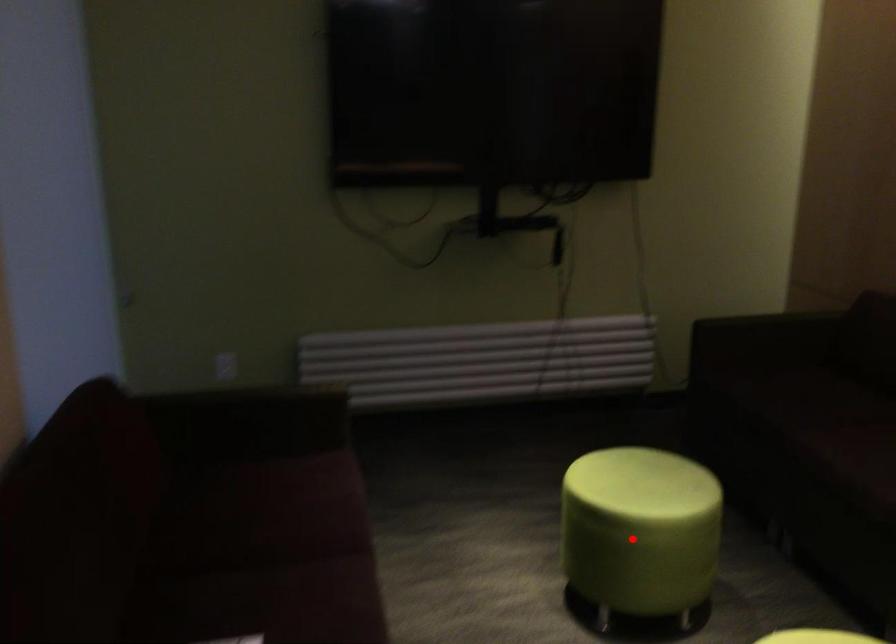
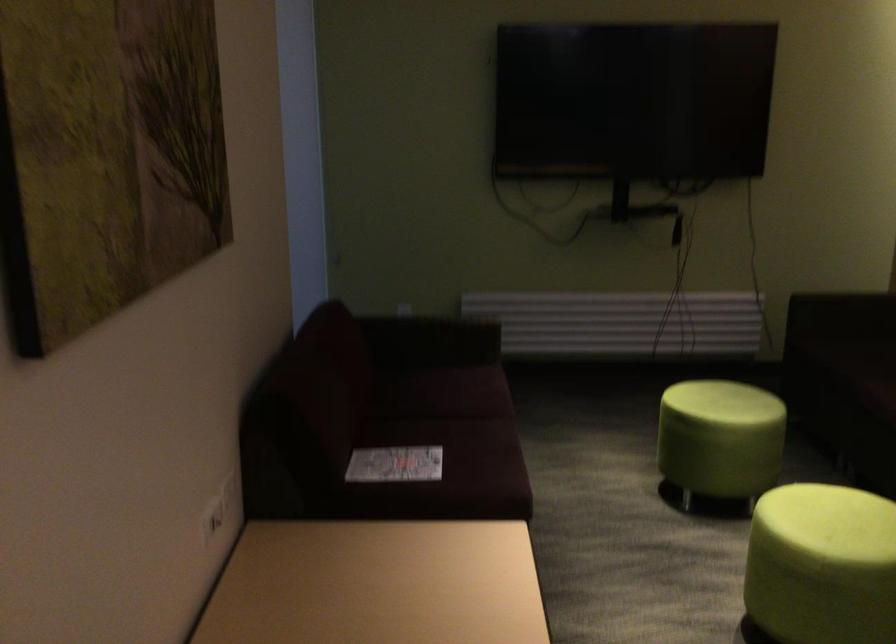
In the second image, find the point that corresponds to the highlighted location in the first image.

(719, 439)